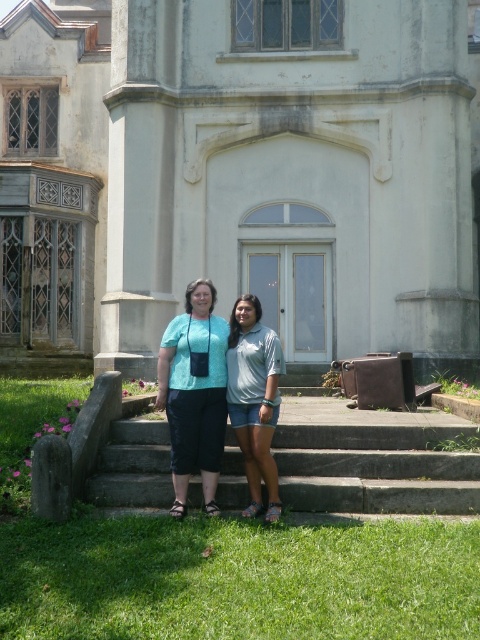
You are standing at the base of the stone steps leading to the old building. You see two points marked in the image. The first point is at coordinates point (455, 628) and the second is at point (248, 397). Which of these points is closer to you, the observer?

Point (455, 628) is in front of point (248, 397), so it is closer to you as the observer.

You are standing in front of the old building and notice the green grass at lower center and the matte teal blouse at center. From your perspective, which object is positioned to the right of the other?

The green grass at lower center is to the right of the matte teal blouse at center.

You are a delivery person standing on the stone steps in front of the old building. You need to place a package on the green grass at lower center. The package is 1.5 meters long. If you start placing it from where you are standing next to the blue denim shorts at center, will the entire package fit on the grass without going beyond the grass area?

The distance between the green grass at lower center and the blue denim shorts at center is 1.41 meters. Since the package is 1.5 meters long, it will extend beyond the grass area by approximately 0.09 meters, so it won